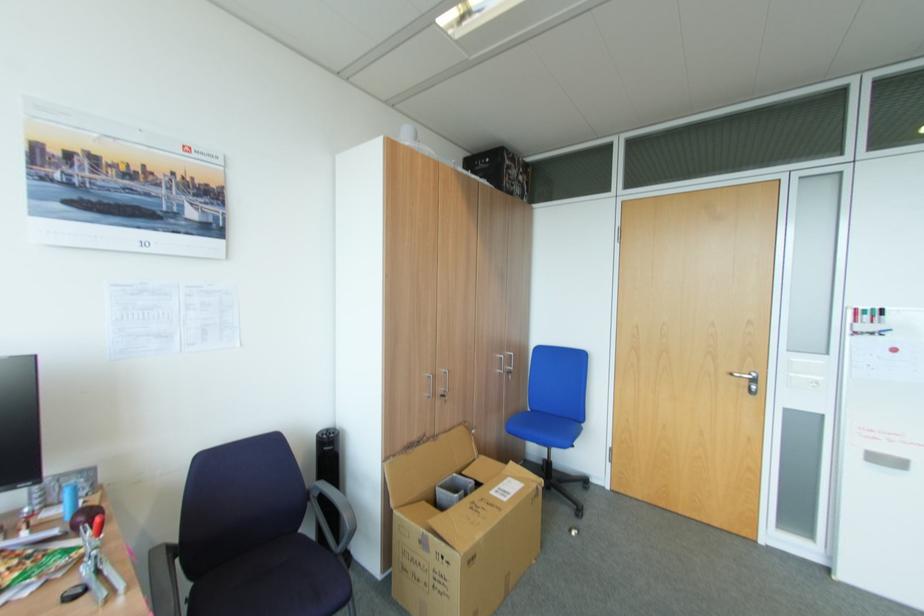
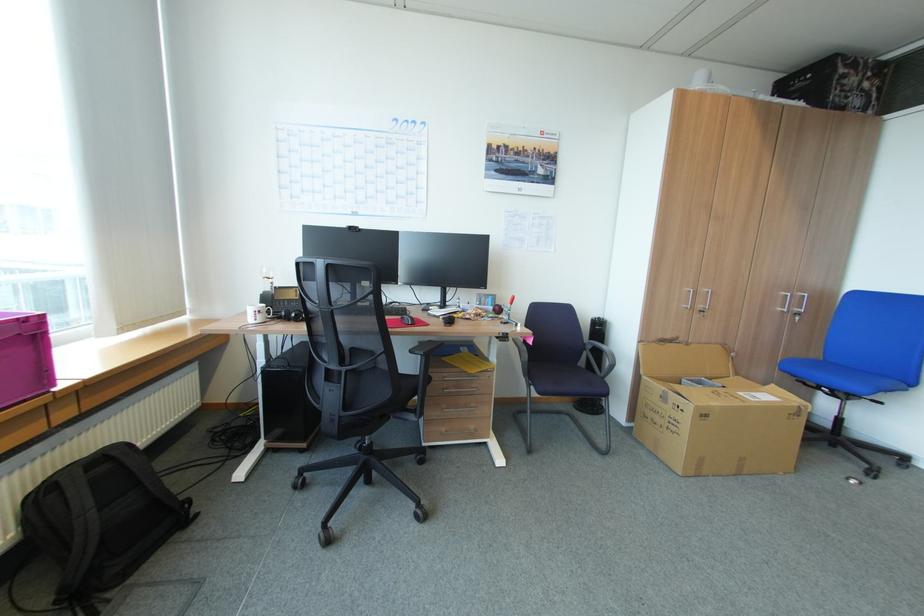
Question: Based on the continuous images, in which direction is the camera rotating? Reply with the corresponding letter.

Choices:
 (A) Left
 (B) Right
 (C) Up
 (D) Down

Answer: (A)